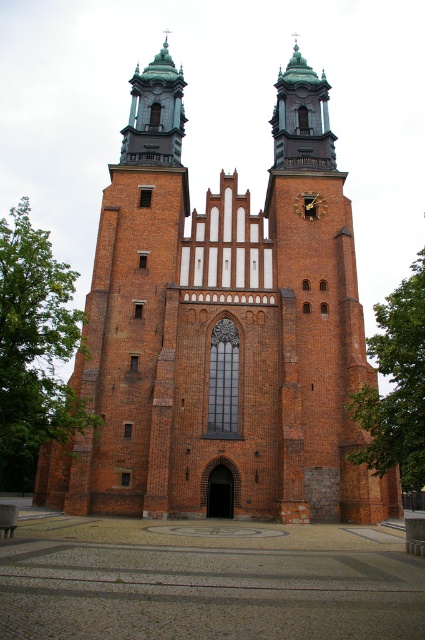
Can you confirm if brick church at center is shorter than gold metallic clock at center?

In fact, brick church at center may be taller than gold metallic clock at center.

Locate an element on the screen. The height and width of the screenshot is (640, 425). brick church at center is located at coordinates (221, 332).